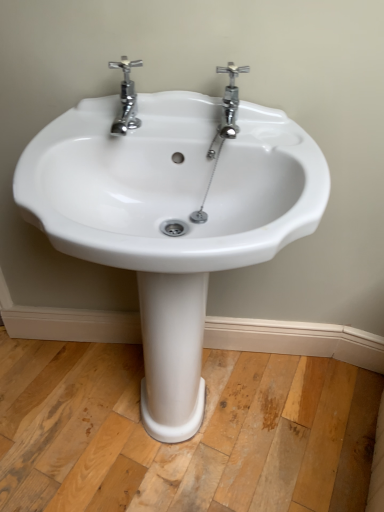
Describe the element at coordinates (126, 98) in the screenshot. This screenshot has height=512, width=384. I see `chrome/metallic faucet at upper left, the first tap from the left` at that location.

Image resolution: width=384 pixels, height=512 pixels. Find the location of `chrome/metallic faucet at upper center, marked as the 2th tap in a left-to-right arrangement`. chrome/metallic faucet at upper center, marked as the 2th tap in a left-to-right arrangement is located at coordinates (230, 101).

Find the location of `white ceramic sink at center`. white ceramic sink at center is located at coordinates (172, 217).

Does chrome/metallic faucet at upper left, the first tap from the left, turn towards chrome/metallic faucet at upper center, marked as the 2th tap in a left-to-right arrangement?

No, chrome/metallic faucet at upper left, the first tap from the left, is not aimed at chrome/metallic faucet at upper center, marked as the 2th tap in a left-to-right arrangement.

The height and width of the screenshot is (512, 384). I want to click on tap located on the right of chrome/metallic faucet at upper left, positioned as the second tap in right-to-left order, so click(x=230, y=101).

Can you confirm if chrome/metallic faucet at upper left, the first tap from the left, is thinner than chrome/metallic faucet at upper center, marked as the 2th tap in a left-to-right arrangement?

Incorrect, the width of chrome/metallic faucet at upper left, the first tap from the left, is not less than that of chrome/metallic faucet at upper center, marked as the 2th tap in a left-to-right arrangement.

Consider the image. Between chrome/metallic faucet at upper left, the first tap from the left, and chrome/metallic faucet at upper center, marked as the 2th tap in a left-to-right arrangement, which one appears on the right side from the viewer's perspective?

Positioned to the right is chrome/metallic faucet at upper center, marked as the 2th tap in a left-to-right arrangement.

Is there a large distance between white ceramic sink at center and chrome/metallic faucet at upper left, positioned as the second tap in right-to-left order?

white ceramic sink at center is actually quite close to chrome/metallic faucet at upper left, positioned as the second tap in right-to-left order.

Considering the positions of objects white ceramic sink at center and chrome/metallic faucet at upper left, positioned as the second tap in right-to-left order, in the image provided, who is in front, white ceramic sink at center or chrome/metallic faucet at upper left, positioned as the second tap in right-to-left order,?

white ceramic sink at center is closer to the camera.

Which of these two, white ceramic sink at center or chrome/metallic faucet at upper left, the first tap from the left, is wider?

white ceramic sink at center is wider.

Can you tell me how much white ceramic sink at center and chrome/metallic faucet at upper left, the first tap from the left, differ in facing direction?

The facing directions of white ceramic sink at center and chrome/metallic faucet at upper left, the first tap from the left, are 0.00142 degrees apart.

Considering the sizes of objects chrome/metallic faucet at upper left, positioned as the second tap in right-to-left order, and white ceramic sink at center in the image provided, who is smaller, chrome/metallic faucet at upper left, positioned as the second tap in right-to-left order, or white ceramic sink at center?

chrome/metallic faucet at upper left, positioned as the second tap in right-to-left order.

Considering the relative sizes of chrome/metallic faucet at upper left, positioned as the second tap in right-to-left order, and white ceramic sink at center in the image provided, is chrome/metallic faucet at upper left, positioned as the second tap in right-to-left order, shorter than white ceramic sink at center?

Yes.

Considering the points (131, 118) and (151, 263), which point is in front, point (131, 118) or point (151, 263)?

The point (151, 263) is closer.

From the image's perspective, who appears lower, chrome/metallic faucet at upper left, the first tap from the left, or white ceramic sink at center?

white ceramic sink at center is shown below in the image.

Is white ceramic sink at center looking in the opposite direction of chrome/metallic faucet at upper center, marked as the 2th tap in a left-to-right arrangement?

No, chrome/metallic faucet at upper center, marked as the 2th tap in a left-to-right arrangement, is not at the back of white ceramic sink at center.

From a real-world perspective, who is located lower, white ceramic sink at center or chrome/metallic faucet at upper center, the first tap in the right-to-left sequence?

In real-world perspective, white ceramic sink at center is lower.

Can you confirm if white ceramic sink at center is shorter than chrome/metallic faucet at upper center, the first tap in the right-to-left sequence?

No, white ceramic sink at center is not shorter than chrome/metallic faucet at upper center, the first tap in the right-to-left sequence.

In the image, is white ceramic sink at center positioned in front of or behind chrome/metallic faucet at upper center, marked as the 2th tap in a left-to-right arrangement?

In the image, white ceramic sink at center appears in front of chrome/metallic faucet at upper center, marked as the 2th tap in a left-to-right arrangement.

Which object is closer to the camera, chrome/metallic faucet at upper center, the first tap in the right-to-left sequence, or white ceramic sink at center?

white ceramic sink at center is in front.

Considering the sizes of objects chrome/metallic faucet at upper center, the first tap in the right-to-left sequence, and white ceramic sink at center in the image provided, who is taller, chrome/metallic faucet at upper center, the first tap in the right-to-left sequence, or white ceramic sink at center?

With more height is white ceramic sink at center.

Which object is positioned more to the left, chrome/metallic faucet at upper center, marked as the 2th tap in a left-to-right arrangement, or white ceramic sink at center?

white ceramic sink at center.

From a real-world perspective, is chrome/metallic faucet at upper center, marked as the 2th tap in a left-to-right arrangement, located beneath white ceramic sink at center?

Incorrect, from a real-world perspective, chrome/metallic faucet at upper center, marked as the 2th tap in a left-to-right arrangement, is higher than white ceramic sink at center.

From the image's perspective, which one is positioned higher, chrome/metallic faucet at upper center, marked as the 2th tap in a left-to-right arrangement, or chrome/metallic faucet at upper left, the first tap from the left?

From the image's view, chrome/metallic faucet at upper left, the first tap from the left, is above.

Between point (229, 65) and point (120, 93), which one is positioned in front?

The point (229, 65) is closer.

Which is more to the right, chrome/metallic faucet at upper center, marked as the 2th tap in a left-to-right arrangement, or chrome/metallic faucet at upper left, the first tap from the left?

chrome/metallic faucet at upper center, marked as the 2th tap in a left-to-right arrangement.

Where is `tap on the right of chrome/metallic faucet at upper left, the first tap from the left`? The height and width of the screenshot is (512, 384). tap on the right of chrome/metallic faucet at upper left, the first tap from the left is located at coordinates tap(230, 101).

You are a GUI agent. You are given a task and a screenshot of the screen. Output one action in this format:
    pyautogui.click(x=<x>, y=<y>)
    Task: Click on the tap behind the chrome/metallic faucet at upper left, the first tap from the left
    
    Given the screenshot: What is the action you would take?
    pyautogui.click(x=230, y=101)

Where is `the 2nd tap positioned above the white ceramic sink at center (from a real-world perspective)`? This screenshot has width=384, height=512. the 2nd tap positioned above the white ceramic sink at center (from a real-world perspective) is located at coordinates (126, 98).

From the image, which object appears to be nearer to chrome/metallic faucet at upper center, marked as the 2th tap in a left-to-right arrangement, chrome/metallic faucet at upper left, the first tap from the left, or white ceramic sink at center?

The object closer to chrome/metallic faucet at upper center, marked as the 2th tap in a left-to-right arrangement, is chrome/metallic faucet at upper left, the first tap from the left.

Looking at the image, which one is located closer to chrome/metallic faucet at upper center, the first tap in the right-to-left sequence, white ceramic sink at center or chrome/metallic faucet at upper left, positioned as the second tap in right-to-left order?

chrome/metallic faucet at upper left, positioned as the second tap in right-to-left order.

When comparing their distances from chrome/metallic faucet at upper left, positioned as the second tap in right-to-left order, does white ceramic sink at center or chrome/metallic faucet at upper center, the first tap in the right-to-left sequence, seem closer?

Among the two, chrome/metallic faucet at upper center, the first tap in the right-to-left sequence, is located nearer to chrome/metallic faucet at upper left, positioned as the second tap in right-to-left order.

Which object lies nearer to the anchor point white ceramic sink at center, chrome/metallic faucet at upper left, positioned as the second tap in right-to-left order, or chrome/metallic faucet at upper center, marked as the 2th tap in a left-to-right arrangement?

Among the two, chrome/metallic faucet at upper left, positioned as the second tap in right-to-left order, is located nearer to white ceramic sink at center.

When comparing their distances from chrome/metallic faucet at upper left, the first tap from the left, does chrome/metallic faucet at upper center, marked as the 2th tap in a left-to-right arrangement, or white ceramic sink at center seem closer?

chrome/metallic faucet at upper center, marked as the 2th tap in a left-to-right arrangement, lies closer to chrome/metallic faucet at upper left, the first tap from the left, than the other object.

From the image, which object appears to be farther from white ceramic sink at center, chrome/metallic faucet at upper center, the first tap in the right-to-left sequence, or chrome/metallic faucet at upper left, the first tap from the left?

chrome/metallic faucet at upper center, the first tap in the right-to-left sequence, is further to white ceramic sink at center.

Where is `tap between chrome/metallic faucet at upper left, the first tap from the left, and white ceramic sink at center vertically`? The height and width of the screenshot is (512, 384). tap between chrome/metallic faucet at upper left, the first tap from the left, and white ceramic sink at center vertically is located at coordinates (230, 101).